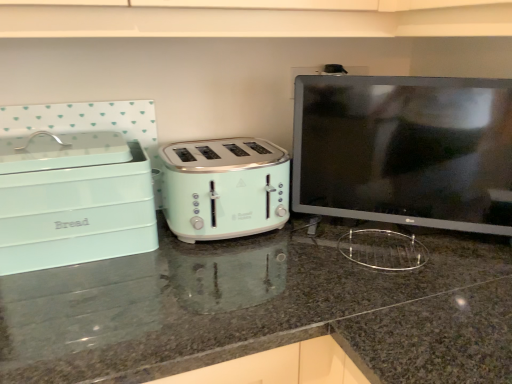
Image resolution: width=512 pixels, height=384 pixels. Find the location of `mint green plastic toaster at center`. mint green plastic toaster at center is located at coordinates (224, 188).

What is the approximate width of mint green plastic toaster at center?

mint green plastic toaster at center is 8.09 inches wide.

The image size is (512, 384). Identify the location of matte green toaster at center. (262, 309).

Find the location of a particular element. The height and width of the screenshot is (384, 512). mint green plastic toaster at center is located at coordinates (224, 188).

Considering the relative sizes of mint green plastic bread bin at left and matte green toaster at center in the image provided, is mint green plastic bread bin at left taller than matte green toaster at center?

No.

Is matte green toaster at center inside mint green plastic bread bin at left?

No, matte green toaster at center is not inside mint green plastic bread bin at left.

How much distance is there between mint green plastic bread bin at left and matte green toaster at center?

mint green plastic bread bin at left is 9.47 inches away from matte green toaster at center.

How many degrees apart are the facing directions of mint green plastic bread bin at left and matte green toaster at center?

They differ by 0.788 degrees in their facing directions.

Where is `countertop below the mint green plastic bread bin at left (from a real-world perspective)`? This screenshot has height=384, width=512. countertop below the mint green plastic bread bin at left (from a real-world perspective) is located at coordinates (262, 309).

From a real-world perspective, which is physically above, matte green toaster at center or mint green plastic bread bin at left?

mint green plastic bread bin at left is physically above.

Which object is wider, matte green toaster at center or mint green plastic bread bin at left?

matte green toaster at center.

Is point (112, 354) less distant than point (76, 233)?

Yes, it is in front of point (76, 233).

Does matte green toaster at center come behind matte black monitor at right?

No, matte green toaster at center is in front of matte black monitor at right.

Considering the sizes of objects matte green toaster at center and matte black monitor at right in the image provided, who is wider, matte green toaster at center or matte black monitor at right?

matte green toaster at center is wider.

Consider the image. Does matte green toaster at center have a lesser height compared to matte black monitor at right?

Incorrect, the height of matte green toaster at center does not fall short of that of matte black monitor at right.

Where is `appliance behind the matte green toaster at center`? This screenshot has width=512, height=384. appliance behind the matte green toaster at center is located at coordinates pyautogui.click(x=405, y=150).

Is mint green plastic bread bin at left far from matte black monitor at right?

Actually, mint green plastic bread bin at left and matte black monitor at right are a little close together.

Is mint green plastic bread bin at left positioned with its back to matte black monitor at right?

No, mint green plastic bread bin at left is not facing the opposite direction of matte black monitor at right.

Which is behind, point (95, 159) or point (504, 134)?

Point (504, 134)

From the image's perspective, relative to matte black monitor at right, is mint green plastic bread bin at left above or below?

From the image's perspective, mint green plastic bread bin at left appears below matte black monitor at right.

Between mint green plastic toaster at center and matte green toaster at center, which one appears on the right side from the viewer's perspective?

From the viewer's perspective, matte green toaster at center appears more on the right side.

Does mint green plastic toaster at center lie in front of matte green toaster at center?

That is False.

Does mint green plastic toaster at center contain matte green toaster at center?

No.

Is mint green plastic toaster at center taller or shorter than matte green toaster at center?

Clearly, mint green plastic toaster at center is shorter compared to matte green toaster at center.

Image resolution: width=512 pixels, height=384 pixels. Find the location of `toaster that is below the matte black monitor at right (from the image's perspective)`. toaster that is below the matte black monitor at right (from the image's perspective) is located at coordinates (224, 188).

How many degrees apart are the facing directions of matte black monitor at right and mint green plastic toaster at center?

The facing directions of matte black monitor at right and mint green plastic toaster at center are 35.9 degrees apart.

Is matte black monitor at right next to mint green plastic toaster at center?

No, matte black monitor at right is not making contact with mint green plastic toaster at center.

Is matte black monitor at right closer to the viewer compared to mint green plastic toaster at center?

Yes, it is in front of mint green plastic toaster at center.

Is matte green toaster at center further to camera compared to mint green plastic toaster at center?

No, matte green toaster at center is in front of mint green plastic toaster at center.

Does matte green toaster at center have a lesser width compared to mint green plastic toaster at center?

In fact, matte green toaster at center might be wider than mint green plastic toaster at center.

Is matte green toaster at center with mint green plastic toaster at center?

matte green toaster at center and mint green plastic toaster at center are not in contact.

Is matte green toaster at center to the left or to the right of mint green plastic toaster at center in the image?

Based on their positions, matte green toaster at center is located to the right of mint green plastic toaster at center.

I want to click on home appliance that appears on the left of matte green toaster at center, so click(74, 201).

Where is `home appliance that is behind the matte green toaster at center`? home appliance that is behind the matte green toaster at center is located at coordinates (74, 201).

Estimate the real-world distances between objects in this image. Which object is closer to matte black monitor at right, matte green toaster at center or mint green plastic bread bin at left?

Based on the image, matte green toaster at center appears to be nearer to matte black monitor at right.

Which object lies further to the anchor point matte black monitor at right, matte green toaster at center or mint green plastic toaster at center?

Based on the image, matte green toaster at center appears to be further to matte black monitor at right.

From the picture: Looking at the image, which one is located further to matte black monitor at right, mint green plastic toaster at center or matte green toaster at center?

Based on the image, matte green toaster at center appears to be further to matte black monitor at right.

Looking at the image, which one is located closer to matte green toaster at center, mint green plastic toaster at center or mint green plastic bread bin at left?

mint green plastic toaster at center is closer to matte green toaster at center.

From the image, which object appears to be nearer to matte green toaster at center, mint green plastic toaster at center or matte black monitor at right?

mint green plastic toaster at center is closer to matte green toaster at center.

From the image, which object appears to be farther from mint green plastic toaster at center, matte green toaster at center or mint green plastic bread bin at left?

Based on the image, matte green toaster at center appears to be further to mint green plastic toaster at center.

From the image, which object appears to be nearer to matte black monitor at right, mint green plastic toaster at center or mint green plastic bread bin at left?

The object closer to matte black monitor at right is mint green plastic toaster at center.

When comparing their distances from mint green plastic toaster at center, does mint green plastic bread bin at left or matte black monitor at right seem closer?

mint green plastic bread bin at left is positioned closer to the anchor mint green plastic toaster at center.

You are a GUI agent. You are given a task and a screenshot of the screen. Output one action in this format:
    pyautogui.click(x=<x>, y=<y>)
    Task: Click on the toaster between mint green plastic bread bin at left and matte black monitor at right
    This screenshot has height=384, width=512.
    Given the screenshot: What is the action you would take?
    pyautogui.click(x=224, y=188)

The height and width of the screenshot is (384, 512). I want to click on countertop between mint green plastic bread bin at left and matte black monitor at right, so click(x=262, y=309).

The width and height of the screenshot is (512, 384). I want to click on home appliance between mint green plastic toaster at center and matte green toaster at center vertically, so click(74, 201).

Where is `toaster between matte black monitor at right and matte green toaster at center in the vertical direction`? toaster between matte black monitor at right and matte green toaster at center in the vertical direction is located at coordinates (224, 188).